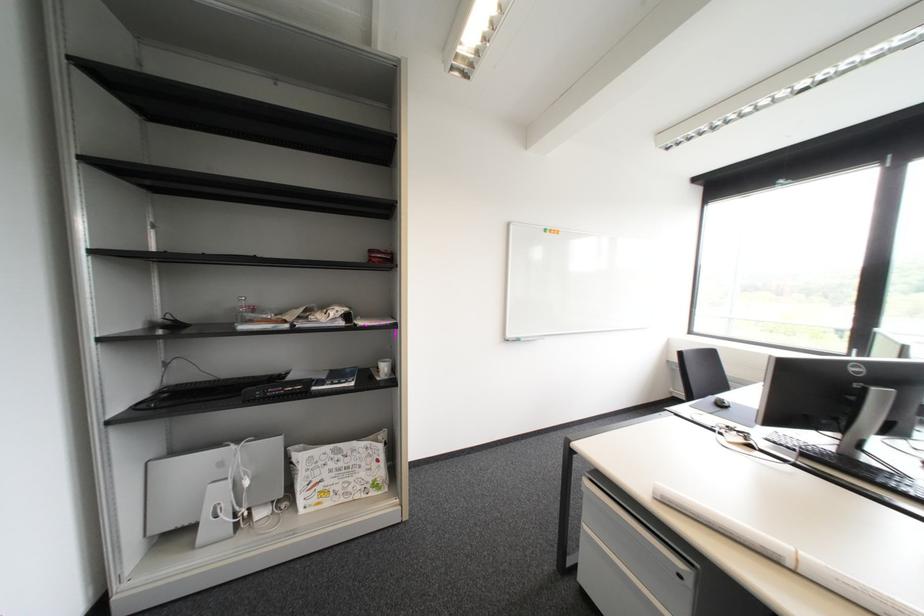
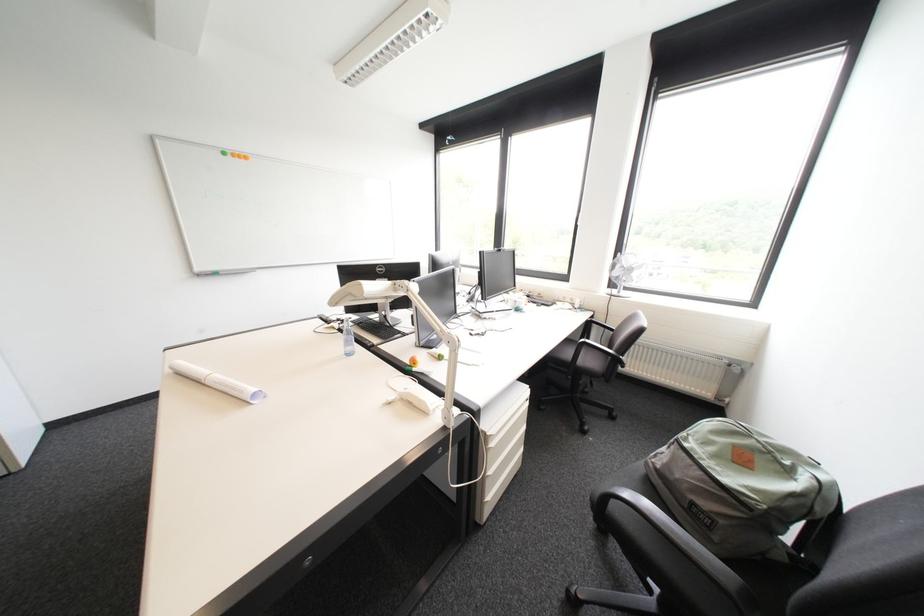
The images are taken continuously from a first-person perspective. In which direction are you moving?

The cameraman walked toward right, backward.